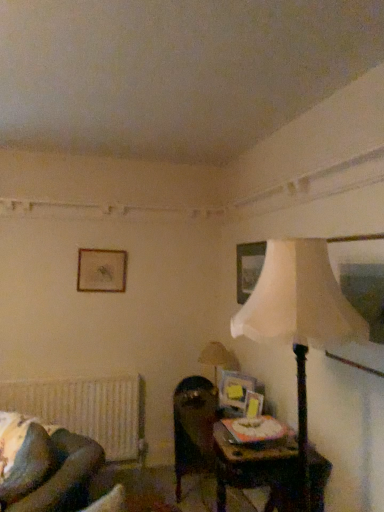
Identify the location of vacant space situated on the left part of matte wooden picture frame at center-right, which ranks as the 3th picture frame in back-to-front order. The image size is (384, 512). (215, 412).